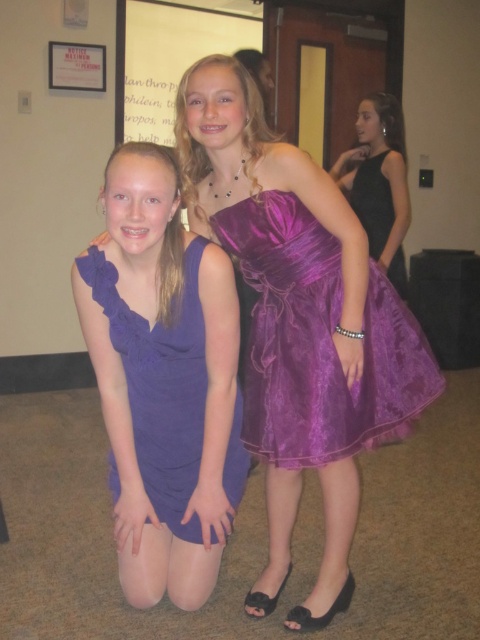
You are a photographer setting up for a group photo. You need to ensure that the black satin dress at right is fully visible in the photo. What should you do about the matte white paper at upper center?

The black satin dress at right is behind the matte white paper at upper center, so to ensure the dress is fully visible, you should adjust the position of the matte white paper at upper center so it does not block the view of the dress.